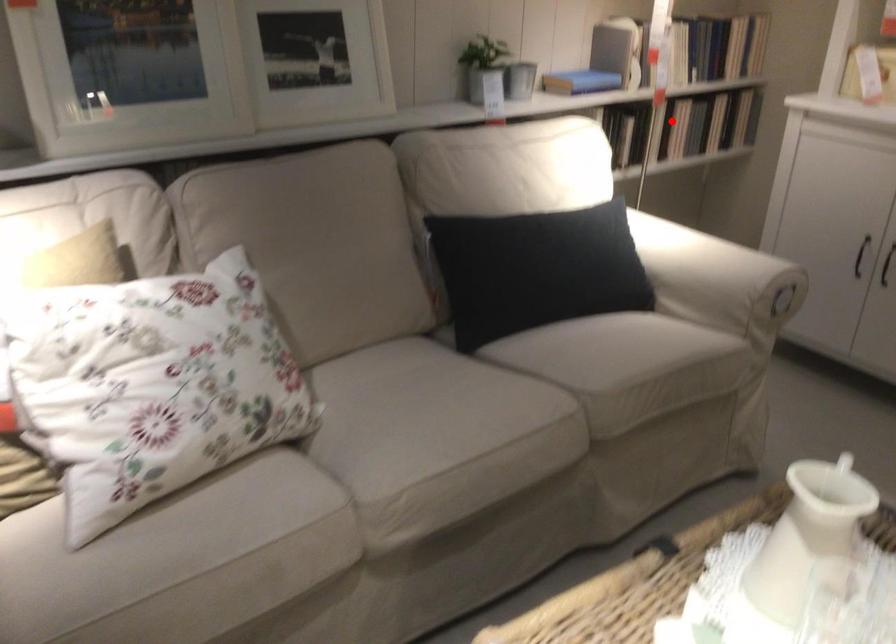
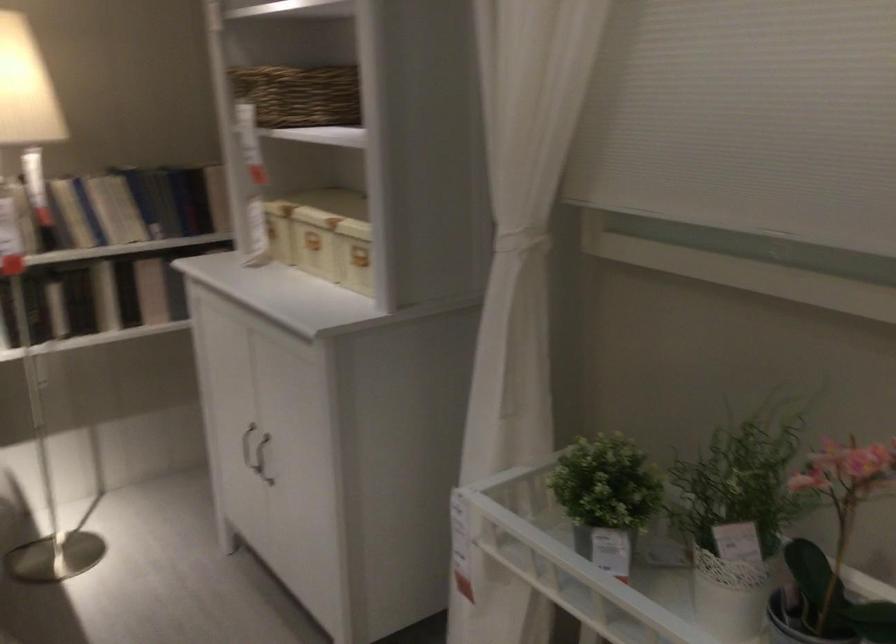
Question: A red point is marked in image1. In image2, is the corresponding 3D point closer to the camera or farther? Reply with the corresponding letter.

Choices:
 (A) The corresponding 3D point is closer.
 (B) The corresponding 3D point is farther.

Answer: (A)